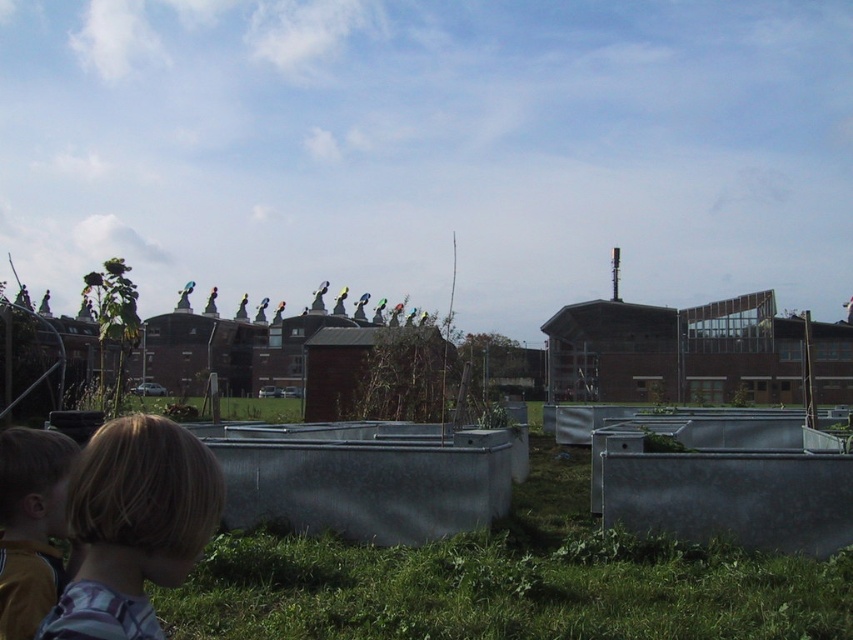
Can you confirm if blonde hair at lower left is wider than yellow jersey at lower left?

Correct, the width of blonde hair at lower left exceeds that of yellow jersey at lower left.

Does blonde hair at lower left have a smaller size compared to yellow jersey at lower left?

Incorrect, blonde hair at lower left is not smaller in size than yellow jersey at lower left.

Image resolution: width=853 pixels, height=640 pixels. What do you see at coordinates (132, 525) in the screenshot?
I see `blonde hair at lower left` at bounding box center [132, 525].

Find the location of a particular element. blonde hair at lower left is located at coordinates (132, 525).